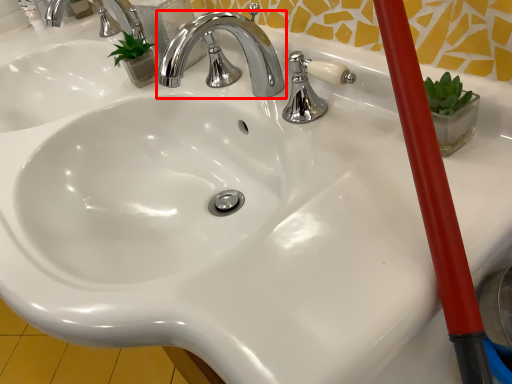
Question: From the image, what is the correct spatial relationship of tap (annotated by the red box) in relation to tap?

Choices:
 (A) right
 (B) left

Answer: (A)